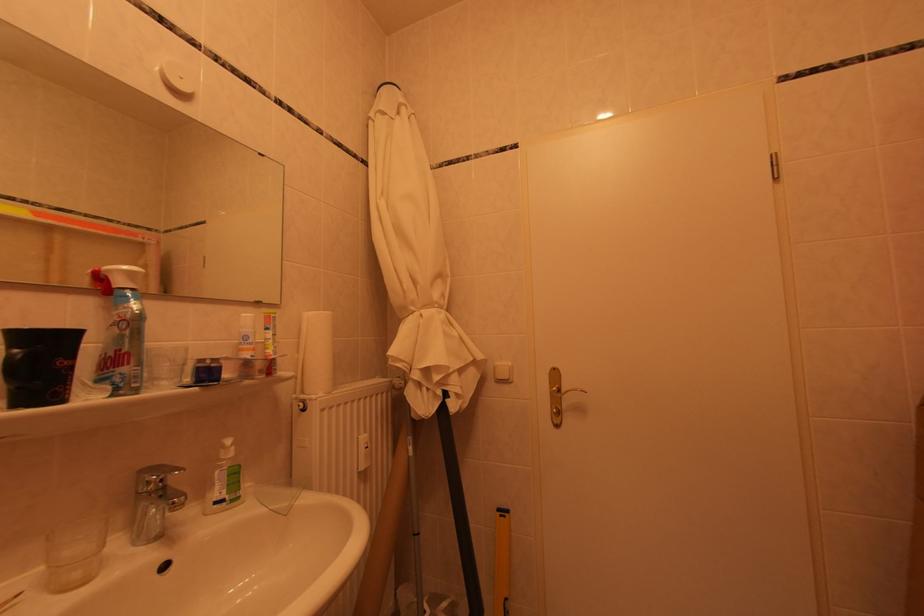
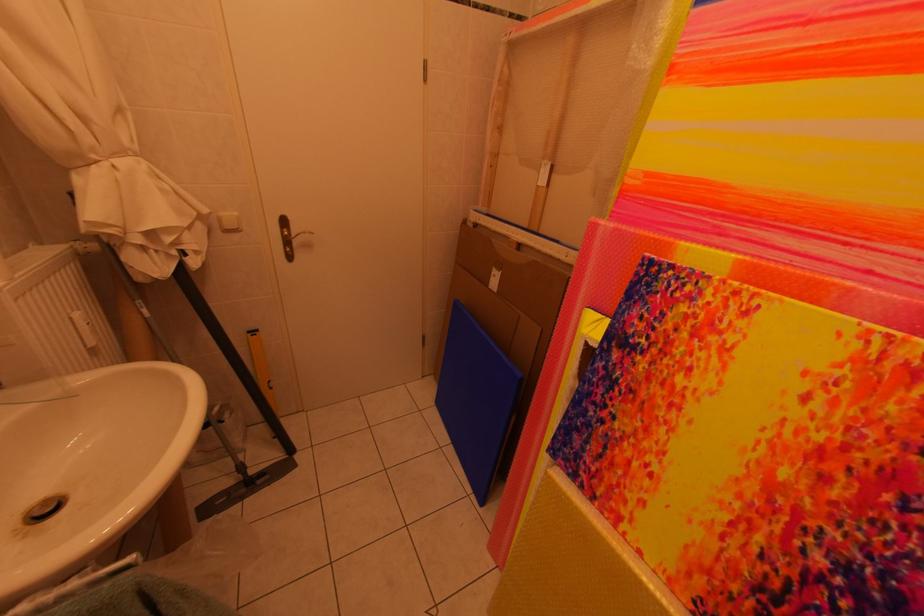
The point at (x=367, y=442) is marked in the first image. Where is the corresponding point in the second image?

(79, 321)